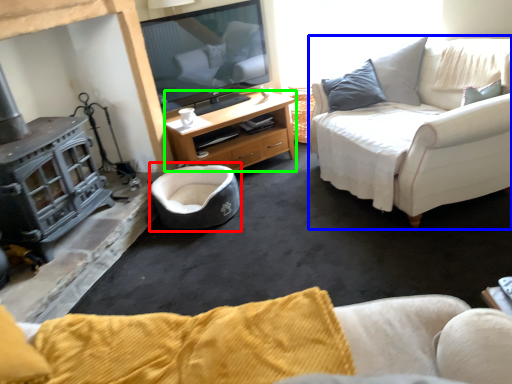
Question: Which object is positioned farthest from bean bag chair (highlighted by a red box)? Select from studio couch (highlighted by a blue box) and desk (highlighted by a green box).

Choices:
 (A) studio couch
 (B) desk

Answer: (A)